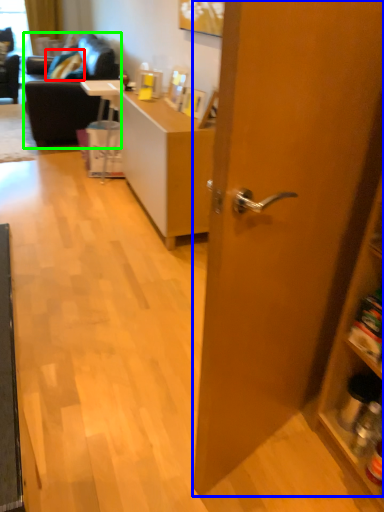
Question: Which is farther away from pillow (highlighted by a red box)? door (highlighted by a blue box) or studio couch (highlighted by a green box)?

Choices:
 (A) door
 (B) studio couch

Answer: (A)